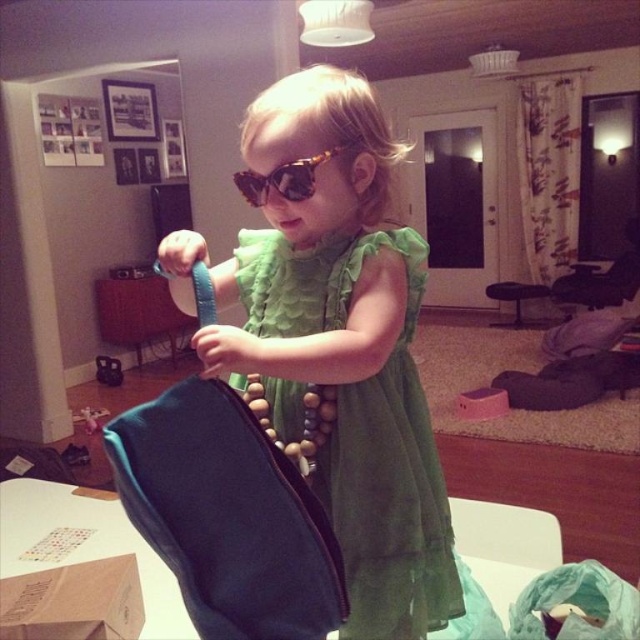
Which of these two, tortoiseshell acetate sunglasses at center or matte black phone at lower left, stands taller?

matte black phone at lower left is taller.

Is point (307, 198) positioned in front of point (113, 371)?

That is True.

What are the coordinates of `tortoiseshell acetate sunglasses at center` in the screenshot? It's located at (x=285, y=177).

Can you confirm if teal fabric bag at center is positioned above pink fabric toy at center?

Indeed, teal fabric bag at center is positioned over pink fabric toy at center.

Locate an element on the screen. The image size is (640, 640). teal fabric bag at center is located at coordinates tap(227, 515).

Which is above, pink fabric toy at center or matte black phone at lower left?

matte black phone at lower left is higher up.

Does pink fabric toy at center appear on the left side of matte black phone at lower left?

In fact, pink fabric toy at center is to the right of matte black phone at lower left.

The image size is (640, 640). Describe the element at coordinates (481, 403) in the screenshot. I see `pink fabric toy at center` at that location.

Identify the location of pink fabric toy at center. This screenshot has width=640, height=640. (481, 403).